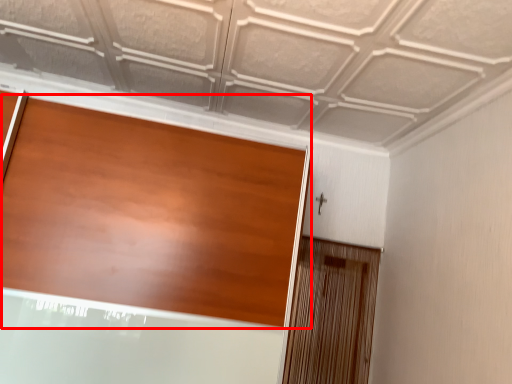
Question: From the image's perspective, what is the correct spatial positioning of door (annotated by the red box) in reference to screen door?

Choices:
 (A) below
 (B) above

Answer: (B)